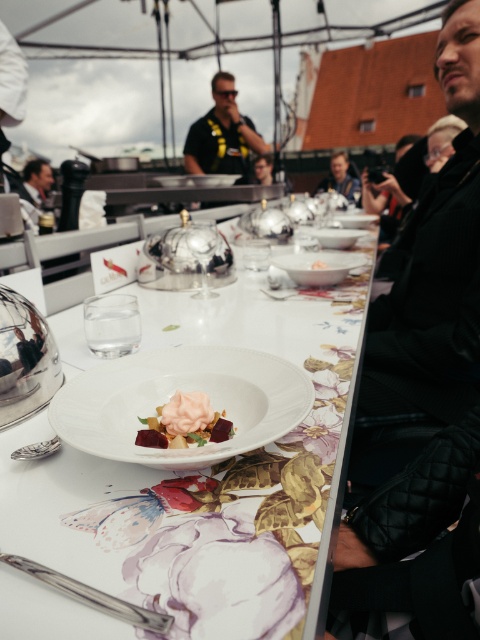
You are setting up a table for a dinner party and need to place a decorative item between the white porcelain bowl at center and the matte black jacket at upper left. Considering their sizes, which object should you place closer to the edge of the table to ensure it doesn

The white porcelain bowl at center has a smaller width than the matte black jacket at upper left, so you should place the decorative item closer to the edge of the table near the white porcelain bowl at center to accommodate the larger matte black jacket at upper left.

You are standing at the entrance of the tent and want to place a new dessert dish on the table. The current dessert is located at point [172,394]. Where should you place the new dessert dish to ensure it is directly in front of the existing one?

The point [172,394] corresponds to the white porcelain bowl at center, so you should place the new dessert dish directly in front of the white porcelain bowl at center.

You are a guest at the outdoor dining event and want to place your napkin on the black jersey at center. However, you notice the white porcelain bowl at center is in the way. Which direction should you move the bowl to access the jersey?

You should move the white porcelain bowl at center to the left since it is currently to the right of the black jersey at center.